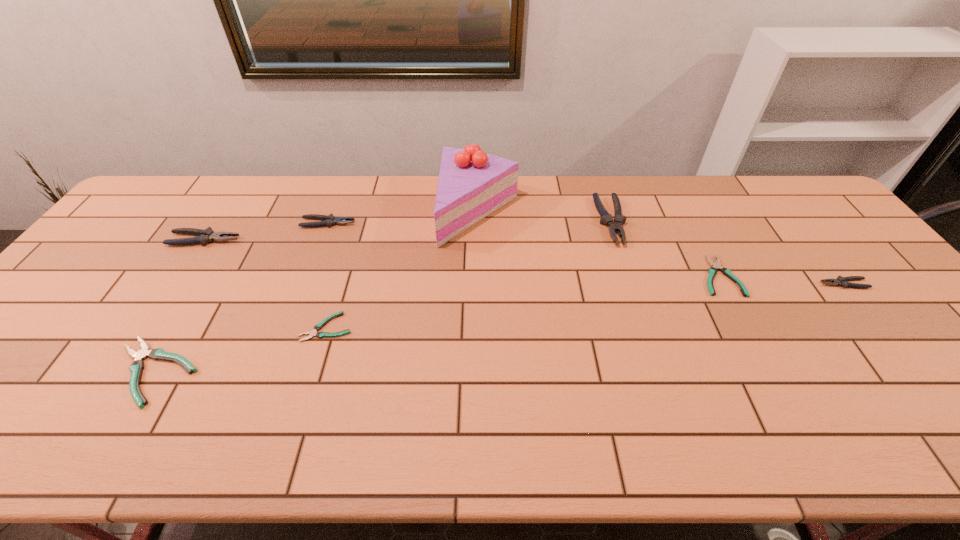
Find the location of a particular element. This screenshot has width=960, height=540. free space located at the gripping part of the smallest gray pliers is located at coordinates (709, 284).

Identify the location of blank space located 0.330m at the gripping part of the smallest gray pliers. Image resolution: width=960 pixels, height=540 pixels. (699, 284).

Where is `vacant space located 0.160m at the gripping part of the smallest gray pliers`? vacant space located 0.160m at the gripping part of the smallest gray pliers is located at coordinates (761, 284).

At what (x,y) coordinates should I click in order to perform the action: click on free region located 0.060m on the front of the third shortest object. Please return your answer as a coordinate pair (x, y). The width and height of the screenshot is (960, 540). Looking at the image, I should click on (115, 437).

Where is `vacant area located 0.220m on the back of the second object from right to left`? The image size is (960, 540). vacant area located 0.220m on the back of the second object from right to left is located at coordinates (684, 210).

In order to click on vacant region located 0.080m on the front of the second teal pliers from right to left in this screenshot , I will do `click(313, 371)`.

Find the location of a particular element. The image size is (960, 540). cake that is at the far edge is located at coordinates (472, 184).

In order to click on object situated at the right edge in this screenshot , I will do `click(842, 281)`.

The height and width of the screenshot is (540, 960). Identify the location of free space at the far edge of the desktop. (307, 175).

Image resolution: width=960 pixels, height=540 pixels. Identify the location of vacant space at the left edge of the desktop. (65, 359).